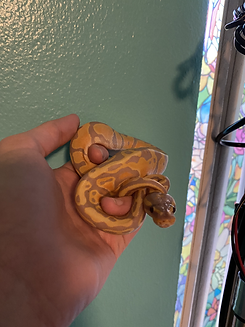
Identify the location of textured glass. (58, 62).